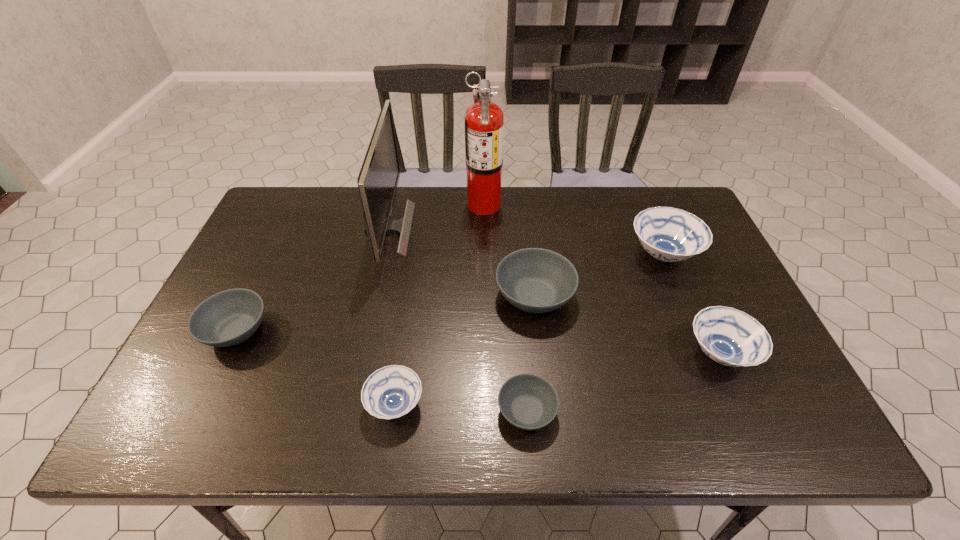
What are the coordinates of `the tallest object` in the screenshot? It's located at tap(484, 122).

Identify the location of red fire extinguisher. (484, 122).

Where is `the seventh shortest object`? the seventh shortest object is located at coordinates (378, 179).

I want to click on the tallest soup bowl, so click(668, 234).

This screenshot has height=540, width=960. Identify the location of the sixth shortest object. (668, 234).

Locate an element on the screen. Image resolution: width=960 pixels, height=540 pixels. the biggest gray soup bowl is located at coordinates (535, 280).

Find the location of `the second smallest blue soup bowl`. the second smallest blue soup bowl is located at coordinates (731, 337).

Where is `the leftmost object`? The width and height of the screenshot is (960, 540). the leftmost object is located at coordinates (230, 317).

Locate an element on the screen. the leftmost gray soup bowl is located at coordinates (230, 317).

Identify the location of the smallest blue soup bowl. pos(390,392).